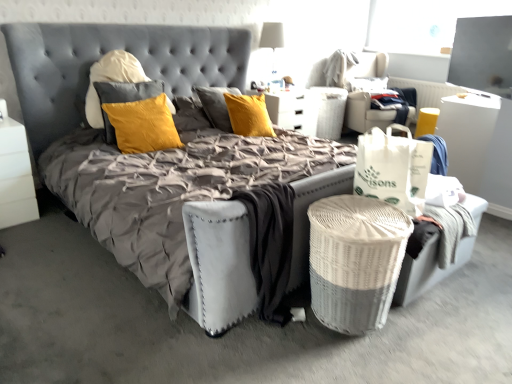
The width and height of the screenshot is (512, 384). What are the coordinates of `unoccupied area in front of white wicker laundry basket at lower right` in the screenshot? It's located at (357, 362).